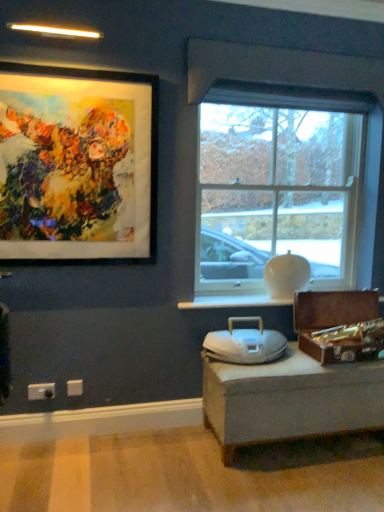
Question: Is matte black picture frame at upper left aimed at clear glass window at center?

Choices:
 (A) yes
 (B) no

Answer: (B)

Question: From a real-world perspective, is matte black picture frame at upper left on top of clear glass window at center?

Choices:
 (A) no
 (B) yes

Answer: (B)

Question: Can you confirm if matte black picture frame at upper left is shorter than clear glass window at center?

Choices:
 (A) no
 (B) yes

Answer: (B)

Question: Is the position of matte black picture frame at upper left less distant than that of clear glass window at center?

Choices:
 (A) yes
 (B) no

Answer: (A)

Question: Is matte black picture frame at upper left bigger than clear glass window at center?

Choices:
 (A) yes
 (B) no

Answer: (B)

Question: From a real-world perspective, is white glossy window sill at center positioned above or below matte black picture frame at upper left?

Choices:
 (A) above
 (B) below

Answer: (B)

Question: Looking at the image, does white glossy window sill at center seem bigger or smaller compared to matte black picture frame at upper left?

Choices:
 (A) big
 (B) small

Answer: (B)

Question: In the image, is white glossy window sill at center on the left side or the right side of matte black picture frame at upper left?

Choices:
 (A) right
 (B) left

Answer: (A)

Question: In terms of height, does white glossy window sill at center look taller or shorter compared to matte black picture frame at upper left?

Choices:
 (A) short
 (B) tall

Answer: (A)

Question: Is white glossy window sill at center taller or shorter than white plastic electric outlet at lower left, the second electric outlet when ordered from back to front?

Choices:
 (A) short
 (B) tall

Answer: (A)

Question: Does point (215, 306) appear closer or farther from the camera than point (49, 393)?

Choices:
 (A) closer
 (B) farther

Answer: (B)

Question: Choose the correct answer: Is white glossy window sill at center inside white plastic electric outlet at lower left, which is the 1th electric outlet in left-to-right order, or outside it?

Choices:
 (A) outside
 (B) inside

Answer: (A)

Question: Considering their positions, is white glossy window sill at center located in front of or behind white plastic electric outlet at lower left, the second electric outlet when ordered from back to front?

Choices:
 (A) behind
 (B) front

Answer: (A)

Question: Considering the positions of white plastic electric outlet at lower left, which ranks as the 2th electric outlet in right-to-left order, and clear glass window at center in the image, is white plastic electric outlet at lower left, which ranks as the 2th electric outlet in right-to-left order, wider or thinner than clear glass window at center?

Choices:
 (A) thin
 (B) wide

Answer: (A)

Question: From their relative heights in the image, would you say white plastic electric outlet at lower left, arranged as the 1th electric outlet when viewed from the front, is taller or shorter than clear glass window at center?

Choices:
 (A) short
 (B) tall

Answer: (A)